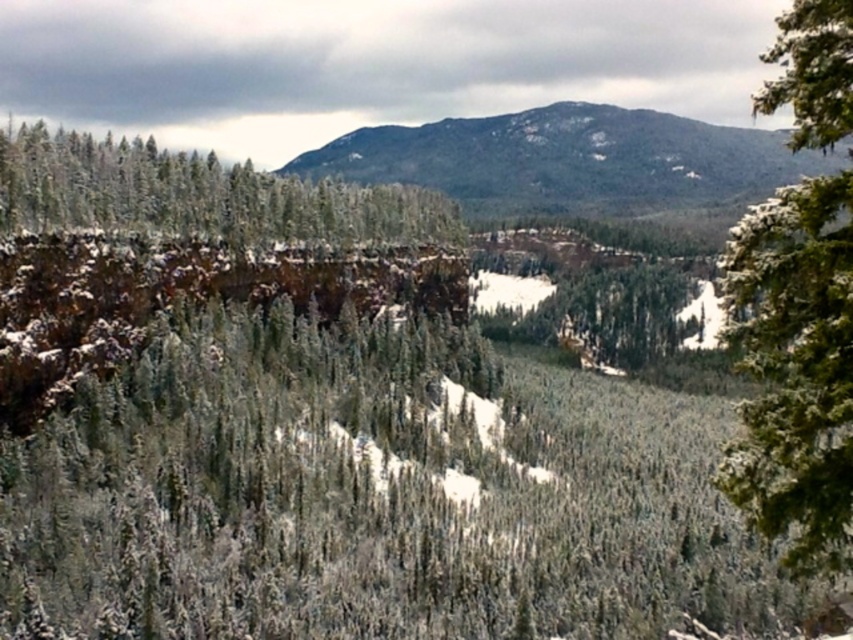
You are an outdoor photographer planning to capture the green textured pine tree at right and the sandy brown rock at center in a single frame. Based on their positions, which object should you focus on first if you want to ensure both are in sharp focus?

The green textured pine tree at right is located below the sandy brown rock at center, so you should focus on the sandy brown rock at center first to ensure both are in sharp focus.

You are standing at the base of the green textured pine tree at right. There is a cabin located 16.83 meters away from you in the direction of the mountains. If you want to walk straight towards the cabin, will you have an unobstructed path through the dense forest of coniferous trees?

The distance between you and the cabin is 16.83 meters, but the dense forest of coniferous trees is closely packed, so your path will likely be obstructed by the trees. You may need to find a cleared trail or alternative route to reach the cabin without obstacles.

You are standing in the winter forest scene and want to move from the point closer to you to the point further away. Which path would you take between the two points, point (807, 326) and point (463, 156)?

You should take the path from point (807, 326) to point (463, 156) because point (807, 326) is closer to the viewer and you need to move towards the point (463, 156) which is further away.